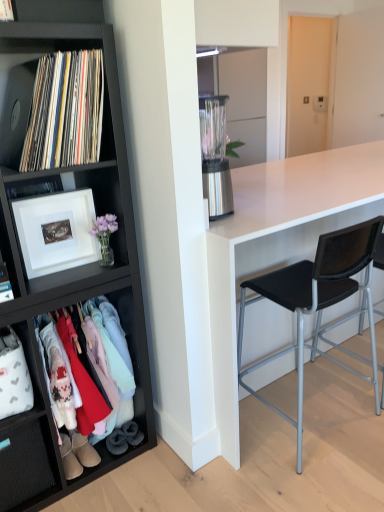
Question: In terms of width, does black matte bookcase at left look wider or thinner when compared to black vinyl records at left?

Choices:
 (A) thin
 (B) wide

Answer: (B)

Question: From a real-world perspective, is black matte bookcase at left physically located above or below black vinyl records at left?

Choices:
 (A) below
 (B) above

Answer: (A)

Question: Based on their relative distances, which object is farther from the leather boot at lower left, which appears as the second footwear when viewed from the right?

Choices:
 (A) black mesh chair at right, which is the 1th chair in left-to-right order
 (B) black plastic chair at right, acting as the first chair starting from the right
 (C) light brown suede boot at lower left, which ranks as the first footwear in right-to-left order
 (D) black matte bookcase at left
 (E) soft gray suede boot at lower left, positioned as the 1th shoe in right-to-left order

Answer: (B)

Question: Which object is positioned farthest from the velvet grey boot at lower left, which is counted as the second shoe, starting from the right?

Choices:
 (A) black matte bookcase at left
 (B) matte black clothing rack at lower left
 (C) light brown suede boot at lower left, which ranks as the first footwear in right-to-left order
 (D) soft gray suede boot at lower left, positioned as the 1th shoe in right-to-left order
 (E) black vinyl records at left

Answer: (E)